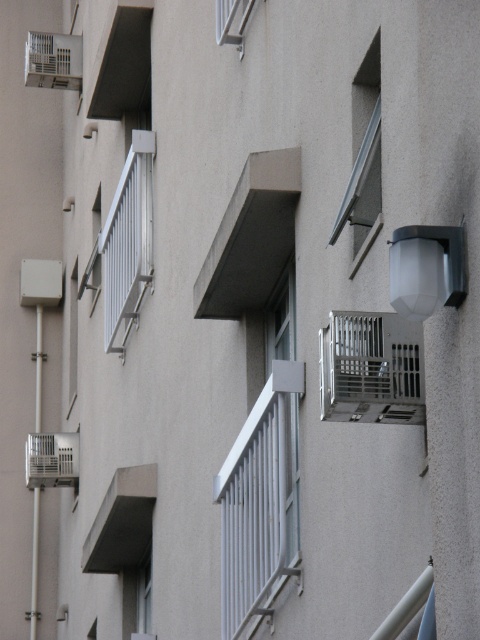
Question: Estimate the real-world distances between objects in this image. Which object is farther from the white matte window at center?

Choices:
 (A) white metal railing at upper left
 (B) metallic silver air conditioner at right
 (C) smooth concrete balcony at center
 (D) metallic gray window at upper right

Answer: (A)

Question: Among these points, which one is farthest from the camera?

Choices:
 (A) (289, 298)
 (B) (339, 228)

Answer: (A)

Question: Can you confirm if white metal railing at upper left is positioned above matte white window at upper center?

Choices:
 (A) yes
 (B) no

Answer: (B)

Question: Which point is closer to the camera?

Choices:
 (A) white plastic balcony at lower left
 (B) white metal railing at upper left
 (C) smooth concrete balcony at center
 (D) matte white window at upper center

Answer: (C)

Question: Does smooth concrete balcony at center have a greater width compared to matte white window at upper center?

Choices:
 (A) yes
 (B) no

Answer: (A)

Question: Can you confirm if metallic gray window at upper right is wider than white metal balcony at upper left?

Choices:
 (A) no
 (B) yes

Answer: (A)